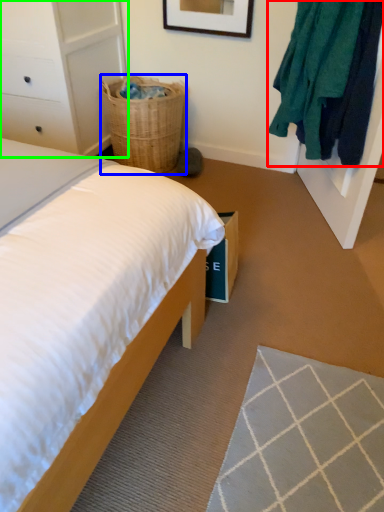
Question: Estimate the real-world distances between objects in this image. Which object is farther from clothing (highlighted by a red box), basket (highlighted by a blue box) or dresser (highlighted by a green box)?

Choices:
 (A) basket
 (B) dresser

Answer: (B)